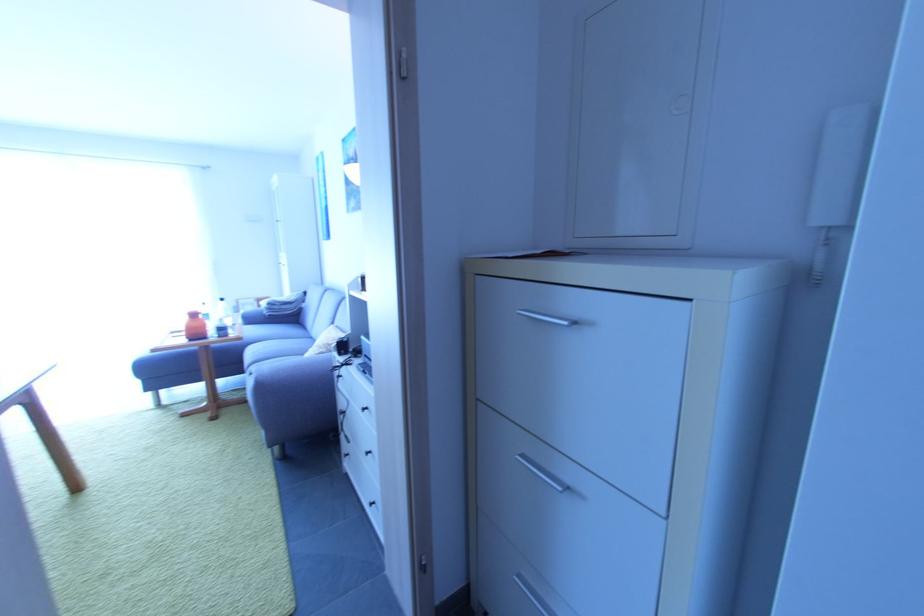
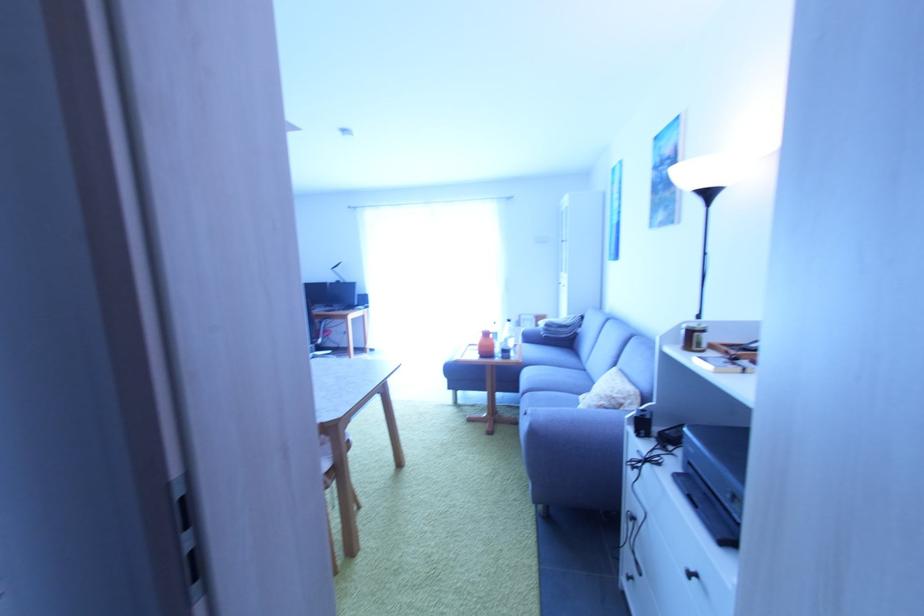
Find the pixel in the second image that matches [264,387] in the first image.

(538, 435)